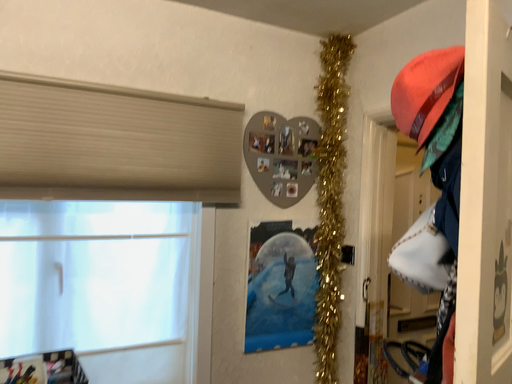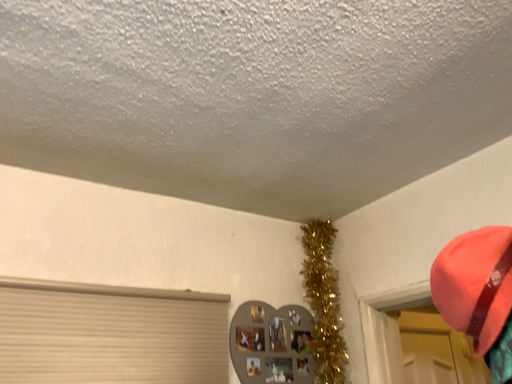
Question: Which way did the camera rotate in the video?

Choices:
 (A) rotated upward
 (B) rotated downward

Answer: (A)